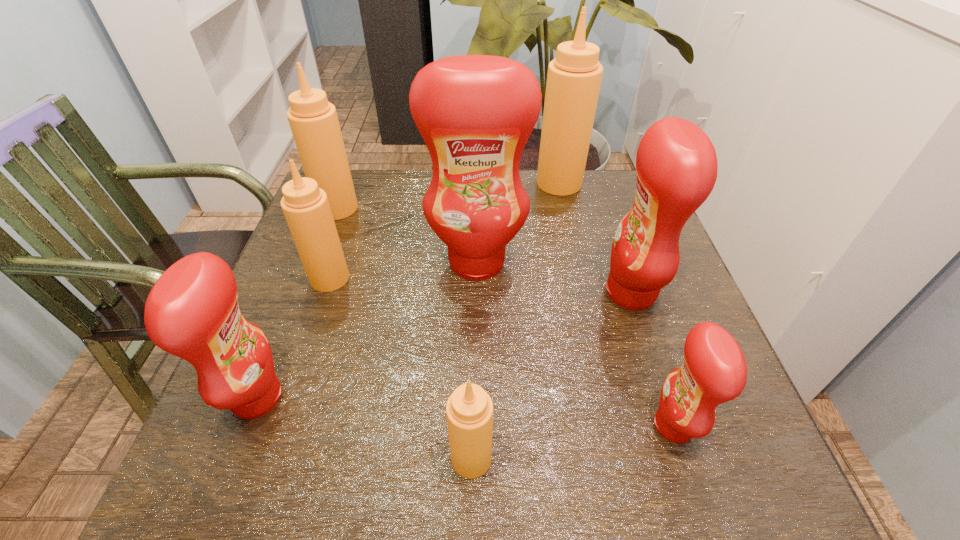
I want to click on the farthest tan condiment, so click(x=574, y=77).

Find the location of a particular element. The image size is (960, 540). the rightmost tan condiment is located at coordinates (574, 77).

This screenshot has height=540, width=960. In order to click on the second red condiment from left to right in this screenshot , I will do `click(475, 113)`.

Locate an element on the screen. Image resolution: width=960 pixels, height=540 pixels. the third smallest tan condiment is located at coordinates (313, 120).

Locate an element on the screen. The width and height of the screenshot is (960, 540). the second farthest tan condiment is located at coordinates (313, 120).

I want to click on the second biggest red condiment, so click(x=676, y=164).

This screenshot has height=540, width=960. I want to click on the second nearest tan condiment, so click(306, 208).

Image resolution: width=960 pixels, height=540 pixels. Identify the location of the third biggest red condiment. (192, 312).

At what (x,y) coordinates should I click in order to perform the action: click on the third tan condiment from left to right. Please return your answer as a coordinate pair (x, y). Looking at the image, I should click on (469, 410).

Locate an element on the screen. The width and height of the screenshot is (960, 540). the nearest tan condiment is located at coordinates (469, 410).